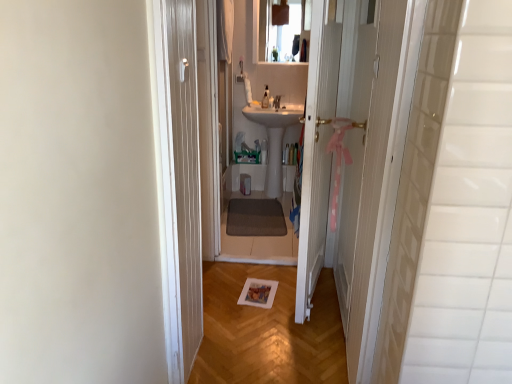
Locate an element on the screen. free space that is in between pink ribbon at right and white wooden door at center is located at coordinates (329, 316).